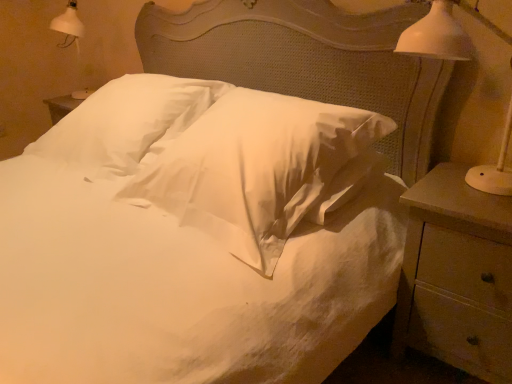
Question: Is white satin pillow at center, which is the second pillow in left-to-right order, to the right of white ceramic lamp at right from the viewer's perspective?

Choices:
 (A) yes
 (B) no

Answer: (B)

Question: Is white satin pillow at center, which is counted as the 1th pillow, starting from the right, looking in the opposite direction of white ceramic lamp at right?

Choices:
 (A) yes
 (B) no

Answer: (B)

Question: From the image's perspective, does white satin pillow at center, which is counted as the 1th pillow, starting from the right, appear lower than white ceramic lamp at right?

Choices:
 (A) yes
 (B) no

Answer: (A)

Question: Does white satin pillow at center, which is counted as the 1th pillow, starting from the right, come behind white ceramic lamp at right?

Choices:
 (A) no
 (B) yes

Answer: (B)

Question: Is white satin pillow at center, which is the second pillow in left-to-right order, placed right next to white ceramic lamp at right?

Choices:
 (A) yes
 (B) no

Answer: (B)

Question: Does white satin pillow at center, which is counted as the 1th pillow, starting from the right, have a greater height compared to white ceramic lamp at right?

Choices:
 (A) yes
 (B) no

Answer: (B)

Question: Is white soft pillow at center, placed as the 1th pillow when sorted from left to right, at the back of white ceramic lamp at right?

Choices:
 (A) yes
 (B) no

Answer: (B)

Question: Is white ceramic lamp at right positioned far away from white soft pillow at center, placed as the 1th pillow when sorted from left to right?

Choices:
 (A) no
 (B) yes

Answer: (B)

Question: Is white ceramic lamp at right surrounding white soft pillow at center, placed as the 1th pillow when sorted from left to right?

Choices:
 (A) no
 (B) yes

Answer: (A)

Question: Is white ceramic lamp at right not inside white soft pillow at center, placed as the 1th pillow when sorted from left to right?

Choices:
 (A) yes
 (B) no

Answer: (A)

Question: Is white ceramic lamp at right with white soft pillow at center, placed as the 1th pillow when sorted from left to right?

Choices:
 (A) no
 (B) yes

Answer: (A)

Question: Considering the relative sizes of white ceramic lamp at right and white soft pillow at center, which is the second pillow from right to left, in the image provided, is white ceramic lamp at right shorter than white soft pillow at center, which is the second pillow from right to left,?

Choices:
 (A) no
 (B) yes

Answer: (A)

Question: Is wooden nightstand at right to the right of white ceramic lamp at right from the viewer's perspective?

Choices:
 (A) yes
 (B) no

Answer: (A)